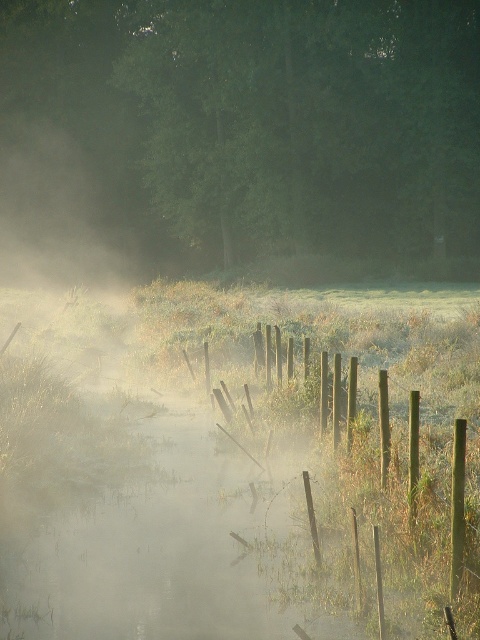
You are a painter standing in the misty landscape and want to capture the scene. Which object, the green matte tree at upper center or the green wooden fence at center, will appear larger in your painting if you paint them to scale?

The green matte tree at upper center will appear larger in your painting because it is much taller than the green wooden fence at center.

You are an artist planning to paint the scene. You want to ensure the green matte tree at upper center and the green wooden fence at center are proportionally accurate. Which object should you make wider in your painting?

The green matte tree at upper center should be made wider in the painting since its width surpasses that of the green wooden fence at center according to the description.